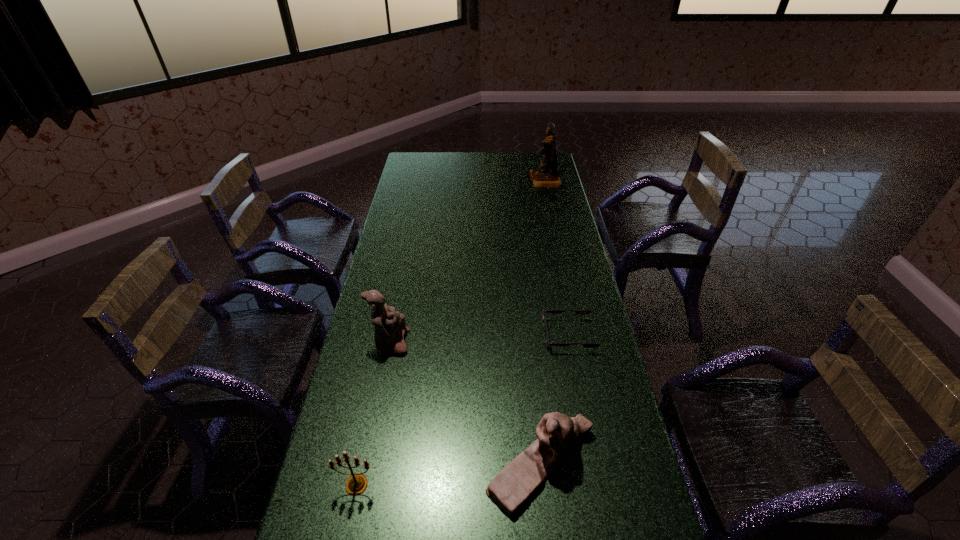
The width and height of the screenshot is (960, 540). Find the location of `the farthest object`. the farthest object is located at coordinates (546, 175).

Where is `the farthest figurine`? the farthest figurine is located at coordinates (546, 175).

In order to click on the leftmost figurine in this screenshot , I will do `click(390, 327)`.

This screenshot has width=960, height=540. Identify the location of the fourth shortest object. 390,327.

The width and height of the screenshot is (960, 540). What are the coordinates of `the nearest figurine` in the screenshot? It's located at (558, 435).

I want to click on candelabrum, so click(357, 483).

I want to click on the shortest object, so click(x=578, y=311).

The height and width of the screenshot is (540, 960). Identify the location of vacant area situated 0.360m on the front-facing side of the farthest figurine. (458, 181).

Image resolution: width=960 pixels, height=540 pixels. In order to click on free region located 0.060m on the front-facing side of the farthest figurine in this screenshot , I will do `click(517, 181)`.

The width and height of the screenshot is (960, 540). I want to click on vacant space located on the front-facing side of the farthest figurine, so tap(517, 181).